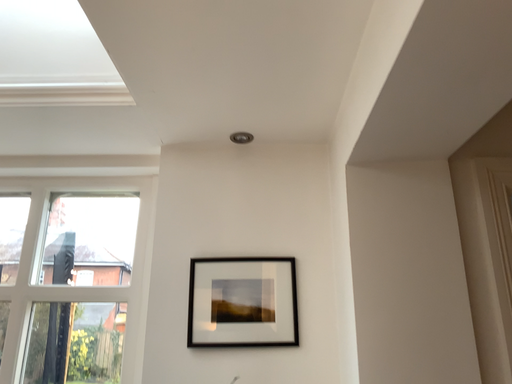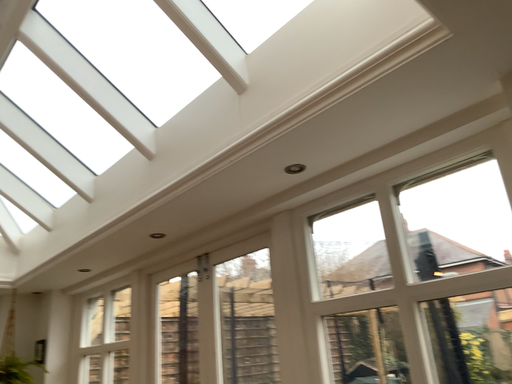
Question: Which way did the camera rotate in the video?

Choices:
 (A) rotated left
 (B) rotated right

Answer: (A)